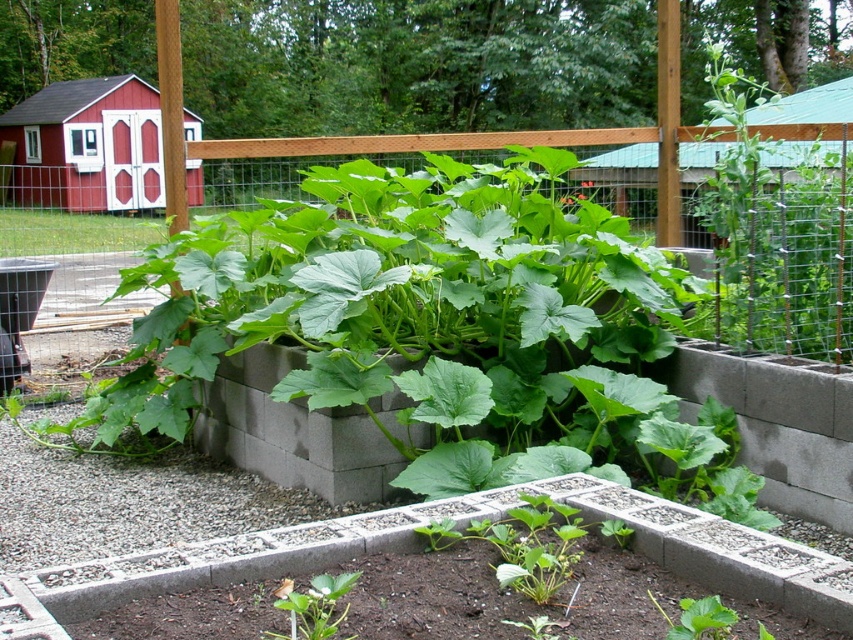
You are a gardener planning to install a new decorative trellis between the wooden fence at upper center and the green leafy plant at center. Considering their sizes, which object should the trellis be placed closer to for better visibility?

The wooden fence at upper center is bigger than the green leafy plant at center, so placing the trellis closer to the smaller green leafy plant at center will make it more visible against the larger fence.

In the garden scene, there is a wooden fence at upper center and a green leafy plant at center. From the perspective of someone standing in front of the garden, which object is positioned to the left?

The wooden fence at upper center is positioned to the left of the green leafy plant at center.